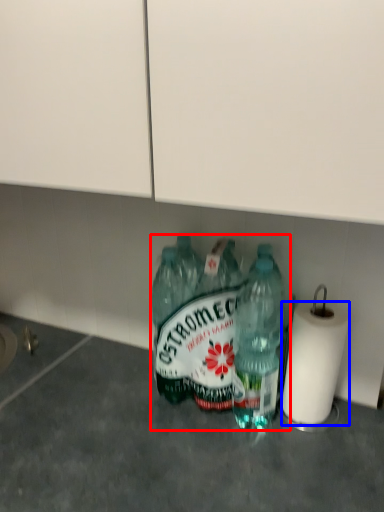
Question: Which object is closer to the camera taking this photo, bottle (highlighted by a red box) or paper towel (highlighted by a blue box)?

Choices:
 (A) bottle
 (B) paper towel

Answer: (B)